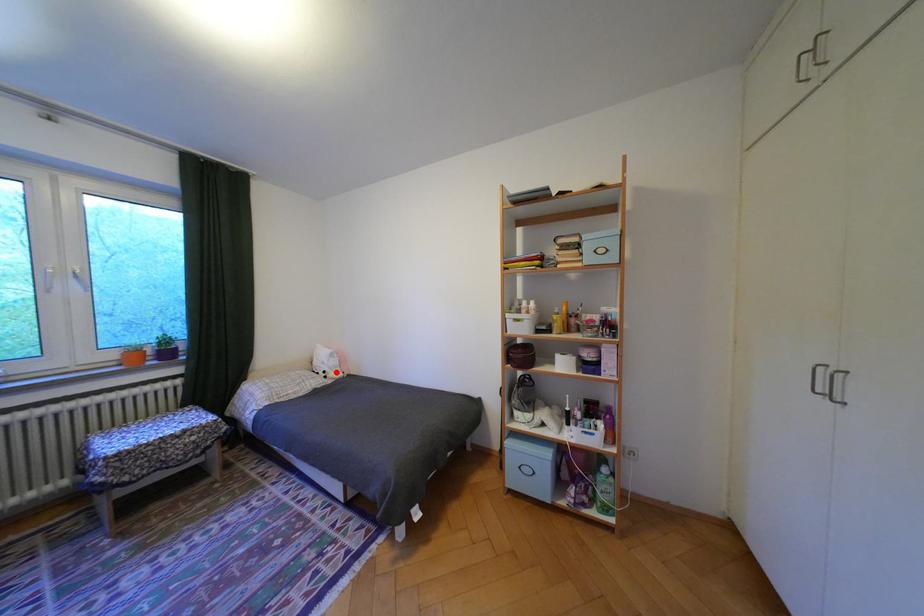
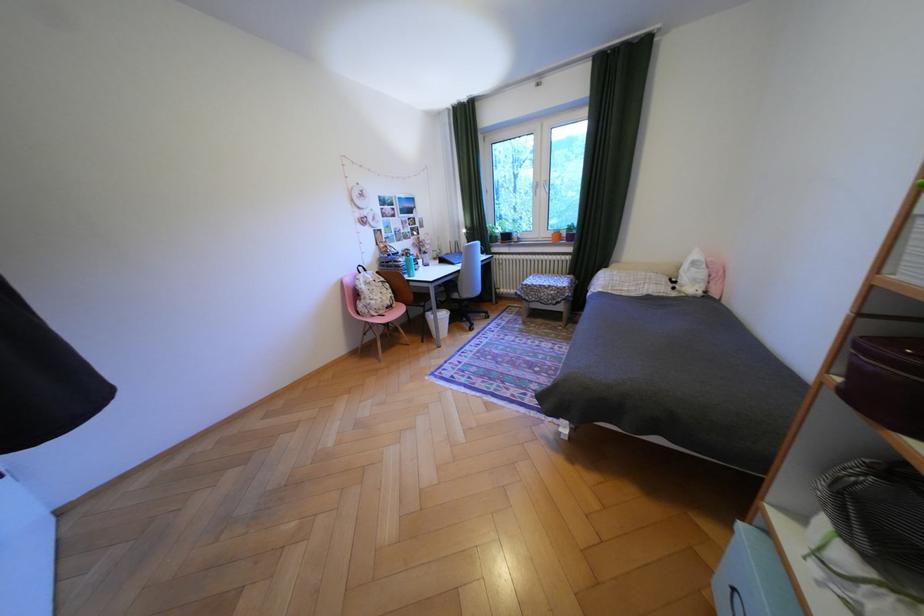
In the second image, find the point that corresponds to the highlighted location in the first image.

(687, 282)